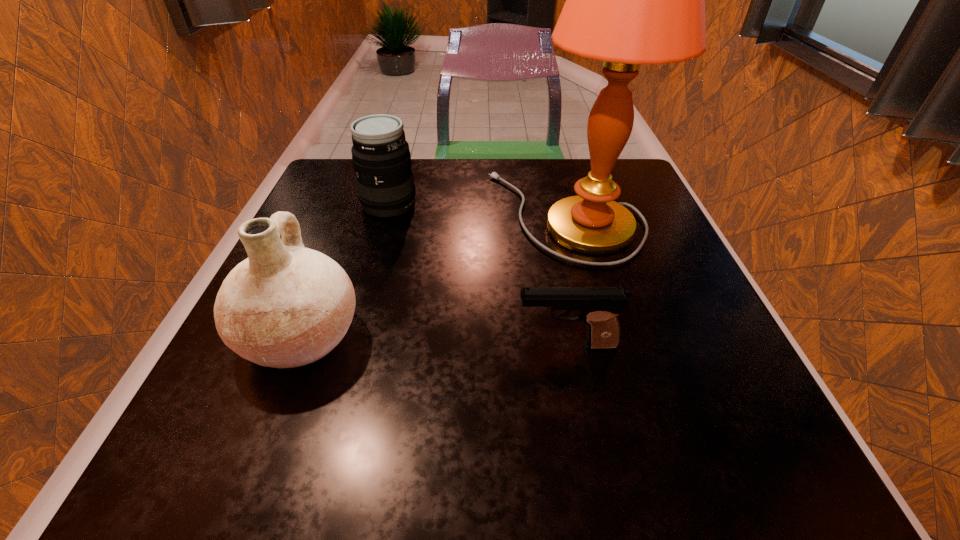
The width and height of the screenshot is (960, 540). Identify the location of the tallest object. (630, 0).

At what (x,y) coordinates should I click in order to perform the action: click on pottery. Please return your answer as a coordinate pair (x, y). This screenshot has width=960, height=540. Looking at the image, I should click on (285, 306).

Find the location of a particular element. the third tallest object is located at coordinates (380, 153).

Locate an element on the screen. The height and width of the screenshot is (540, 960). the shortest object is located at coordinates (600, 306).

The height and width of the screenshot is (540, 960). I want to click on vacant region located on the front of the tallest object, so click(x=621, y=434).

The height and width of the screenshot is (540, 960). Find the location of `free space located 0.050m to pour from the handle of the pottery`. free space located 0.050m to pour from the handle of the pottery is located at coordinates (393, 338).

The width and height of the screenshot is (960, 540). I want to click on vacant region located 0.120m on the left of the telephoto lens, so click(x=308, y=204).

Locate an element on the screen. This screenshot has width=960, height=540. vacant space situated 0.280m at the barrel of the pistol is located at coordinates (342, 345).

Identify the location of vacant space located 0.400m at the barrel of the pistol. (267, 345).

Find the location of a particular element. free location located at the barrel of the pistol is located at coordinates (454, 345).